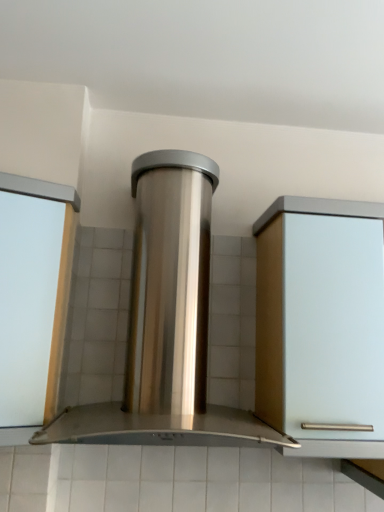
Question: Is point (201, 202) positioned closer to the camera than point (56, 403)?

Choices:
 (A) farther
 (B) closer

Answer: (A)

Question: Considering the positions of stainless steel range hood at center and white glossy door at left in the image, is stainless steel range hood at center wider or thinner than white glossy door at left?

Choices:
 (A) wide
 (B) thin

Answer: (A)

Question: Is stainless steel range hood at center bigger or smaller than white glossy door at left?

Choices:
 (A) big
 (B) small

Answer: (A)

Question: Is white glossy door at left taller or shorter than stainless steel range hood at center?

Choices:
 (A) tall
 (B) short

Answer: (B)

Question: Is white glossy door at left situated inside stainless steel range hood at center or outside?

Choices:
 (A) inside
 (B) outside

Answer: (B)

Question: Considering the positions of white glossy door at left and stainless steel range hood at center in the image, is white glossy door at left wider or thinner than stainless steel range hood at center?

Choices:
 (A) thin
 (B) wide

Answer: (A)

Question: Based on their positions, is white glossy door at left located to the left or right of stainless steel range hood at center?

Choices:
 (A) left
 (B) right

Answer: (A)